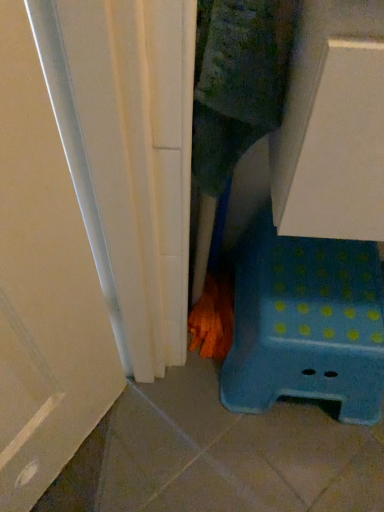
This screenshot has width=384, height=512. Describe the element at coordinates (213, 318) in the screenshot. I see `orange textured broom at lower center` at that location.

Locate an element on the screen. This screenshot has width=384, height=512. orange textured broom at lower center is located at coordinates (213, 318).

In order to face blue plastic stool at lower right, should I rotate leftwards or rightwards?

A 15.420 degree turn to the right will do.

Find the location of `blue plastic stool at lower right`. blue plastic stool at lower right is located at coordinates (305, 324).

Measure the distance between blue plastic stool at lower right and camera.

29.36 inches.

The height and width of the screenshot is (512, 384). What do you see at coordinates (305, 324) in the screenshot?
I see `blue plastic stool at lower right` at bounding box center [305, 324].

Identify the location of orange textured broom at lower center. The width and height of the screenshot is (384, 512). (213, 318).

Is orange textured broom at lower center at the left side of blue plastic stool at lower right?

Indeed, orange textured broom at lower center is positioned on the left side of blue plastic stool at lower right.

Relative to blue plastic stool at lower right, is orange textured broom at lower center in front or behind?

Clearly, orange textured broom at lower center is behind blue plastic stool at lower right.

Which point is more distant from viewer, (208,280) or (297,383)?

The point (208,280) is behind.

From the image's perspective, does orange textured broom at lower center appear lower than blue plastic stool at lower right?

Yes.

From a real-world perspective, is orange textured broom at lower center located beneath blue plastic stool at lower right?

Yes, from a real-world perspective, orange textured broom at lower center is beneath blue plastic stool at lower right.

Looking at their sizes, would you say orange textured broom at lower center is wider or thinner than blue plastic stool at lower right?

orange textured broom at lower center is thinner than blue plastic stool at lower right.

Based on the photo, between orange textured broom at lower center and blue plastic stool at lower right, which one has less height?

orange textured broom at lower center is shorter.

Which of these two, orange textured broom at lower center or blue plastic stool at lower right, is bigger?

blue plastic stool at lower right is bigger.

Is orange textured broom at lower center located outside blue plastic stool at lower right?

Yes, orange textured broom at lower center is outside of blue plastic stool at lower right.

Are orange textured broom at lower center and blue plastic stool at lower right located far from each other?

orange textured broom at lower center is actually quite close to blue plastic stool at lower right.

Is orange textured broom at lower center facing towards blue plastic stool at lower right?

No, orange textured broom at lower center is not turned towards blue plastic stool at lower right.

Measure the distance from orange textured broom at lower center to blue plastic stool at lower right.

8.71 inches.

Where is `furniture in front of the orange textured broom at lower center`? This screenshot has width=384, height=512. furniture in front of the orange textured broom at lower center is located at coordinates (305, 324).

Which is more to the right, blue plastic stool at lower right or orange textured broom at lower center?

Positioned to the right is blue plastic stool at lower right.

Which is behind, blue plastic stool at lower right or orange textured broom at lower center?

orange textured broom at lower center is further from the camera.

Does point (303, 353) come closer to viewer compared to point (222, 289)?

Yes, it is in front of point (222, 289).

From the image's perspective, would you say blue plastic stool at lower right is shown under orange textured broom at lower center?

No, from the image's perspective, blue plastic stool at lower right is not below orange textured broom at lower center.

From a real-world perspective, is blue plastic stool at lower right physically located above or below orange textured broom at lower center?

blue plastic stool at lower right is situated higher than orange textured broom at lower center in the real world.

Does blue plastic stool at lower right have a lesser width compared to orange textured broom at lower center?

No, blue plastic stool at lower right is not thinner than orange textured broom at lower center.

Is blue plastic stool at lower right shorter than orange textured broom at lower center?

Incorrect, the height of blue plastic stool at lower right does not fall short of that of orange textured broom at lower center.

Can you confirm if blue plastic stool at lower right is smaller than orange textured broom at lower center?

Incorrect, blue plastic stool at lower right is not smaller in size than orange textured broom at lower center.

Is blue plastic stool at lower right completely or partially outside of orange textured broom at lower center?

That's correct, blue plastic stool at lower right is outside of orange textured broom at lower center.

Is blue plastic stool at lower right not near orange textured broom at lower center?

Actually, blue plastic stool at lower right and orange textured broom at lower center are a little close together.

Is blue plastic stool at lower right facing towards orange textured broom at lower center?

No, blue plastic stool at lower right is not oriented towards orange textured broom at lower center.

What's the angular difference between blue plastic stool at lower right and orange textured broom at lower center's facing directions?

The facing directions of blue plastic stool at lower right and orange textured broom at lower center are 0.000295 degrees apart.

Find the location of `furniture on the right side of orange textured broom at lower center`. furniture on the right side of orange textured broom at lower center is located at coordinates (305, 324).

This screenshot has height=512, width=384. I want to click on hand below the blue plastic stool at lower right (from the image's perspective), so click(213, 318).

This screenshot has height=512, width=384. I want to click on furniture positioned vertically above the orange textured broom at lower center (from a real-world perspective), so click(305, 324).